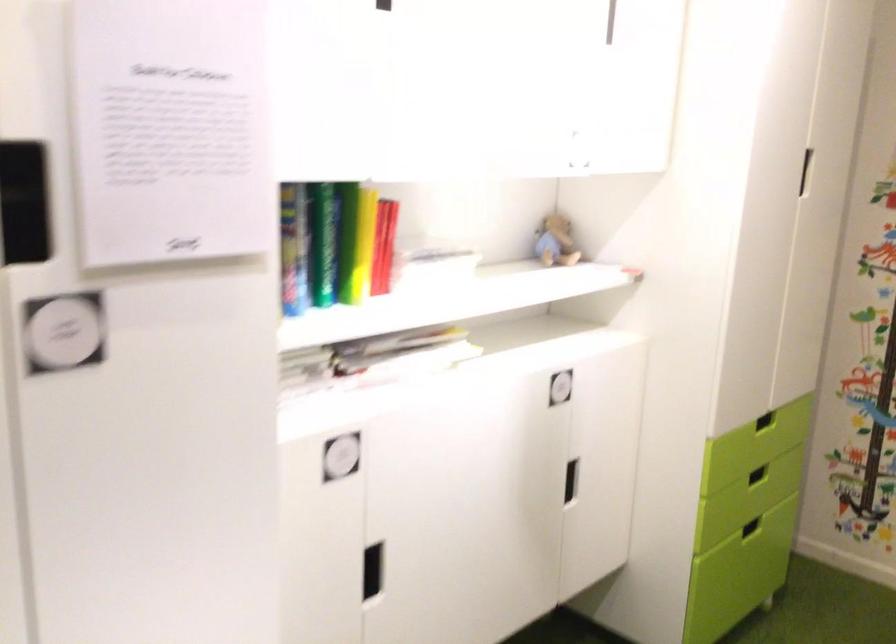
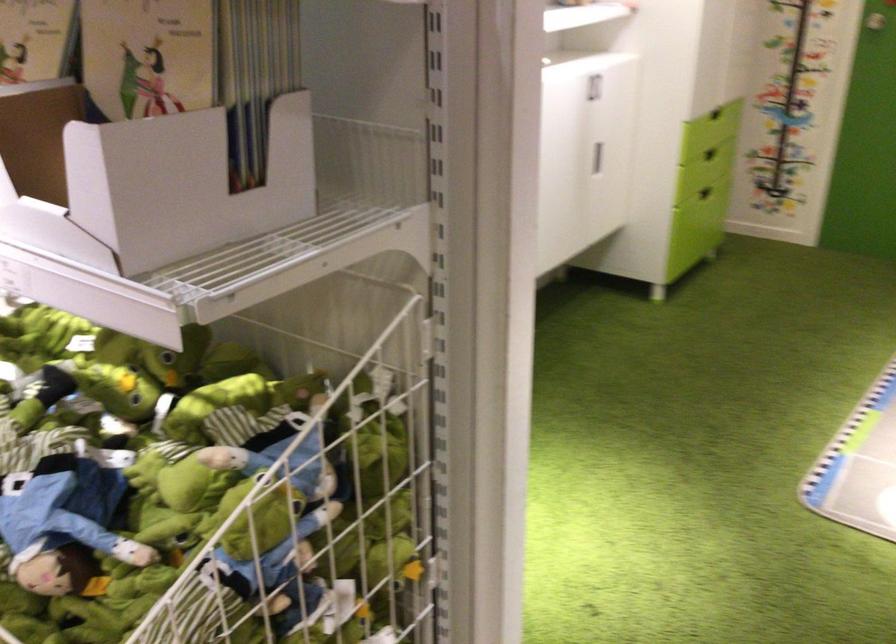
Locate, in the second image, the point that corresponds to pixel 570 483 in the first image.

(597, 158)